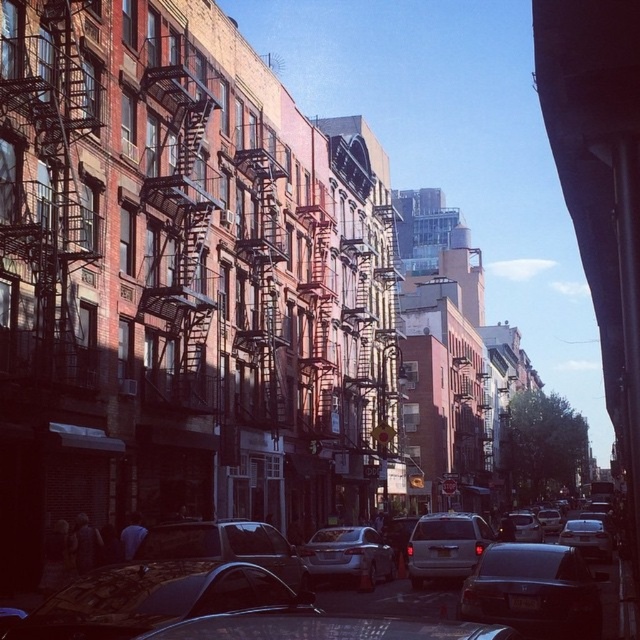
Who is positioned more to the left, matte black sedan at center or shiny silver sedan at center?

From the viewer's perspective, shiny silver sedan at center appears more on the left side.

Is matte black sedan at center bigger than shiny silver sedan at center?

Indeed, matte black sedan at center has a larger size compared to shiny silver sedan at center.

Where is `matte black sedan at center`? matte black sedan at center is located at coordinates (376, 588).

Is point (348, 573) in front of point (531, 532)?

Yes, point (348, 573) is closer to viewer.

Locate an element on the screen. Image resolution: width=640 pixels, height=640 pixels. satin silver sedan at center is located at coordinates (348, 554).

Is the position of shiny black car at lower left more distant than that of satin silver sedan at lower right?

That is False.

Consider the image. Which is more to the right, shiny black car at lower left or satin silver sedan at lower right?

From the viewer's perspective, satin silver sedan at lower right appears more on the right side.

Is point (195, 612) behind point (568, 538)?

No, (195, 612) is closer to viewer.

Find the location of a particular element. The width and height of the screenshot is (640, 640). shiny black car at lower left is located at coordinates (156, 600).